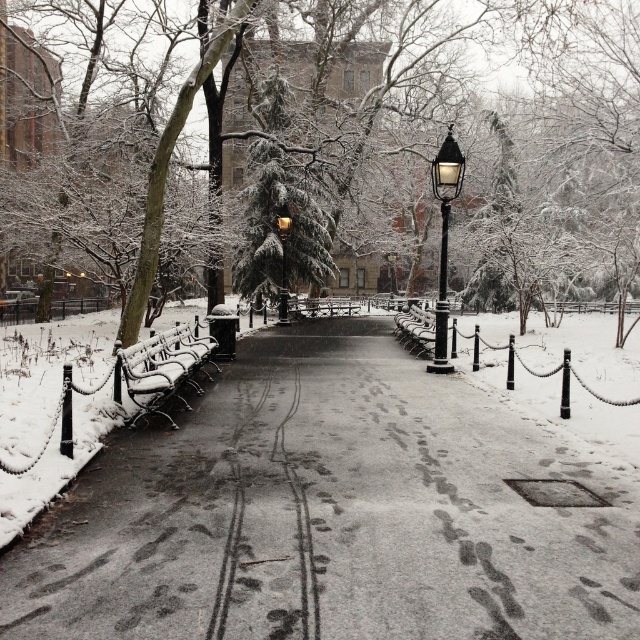
Question: Is snowy concrete path at center bigger than black glass lamp post at center?

Choices:
 (A) yes
 (B) no

Answer: (B)

Question: Considering the real-world distances, which object is closest to the snowy concrete path at center?

Choices:
 (A) gold polished metal streetlight at center
 (B) snow-covered evergreen tree at center
 (C) snow-covered wood bench at left

Answer: (C)

Question: Which point is closer to the camera?

Choices:
 (A) (x=406, y=412)
 (B) (x=284, y=291)

Answer: (A)

Question: Does snowy concrete path at center appear on the left side of snow-covered evergreen tree at center?

Choices:
 (A) no
 (B) yes

Answer: (A)

Question: Can you confirm if snowy concrete path at center is bigger than snow-covered evergreen tree at center?

Choices:
 (A) no
 (B) yes

Answer: (A)

Question: Which of the following is the closest to the observer?

Choices:
 (A) (282, 241)
 (B) (131, 380)
 (C) (381, 410)

Answer: (B)